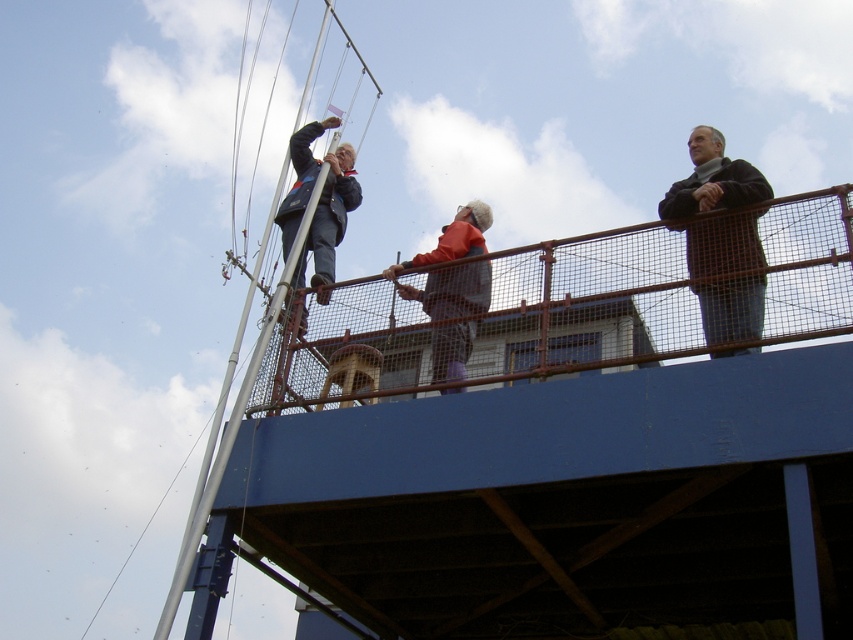
Question: Which point is farther from the camera taking this photo?

Choices:
 (A) (299, 195)
 (B) (462, 371)
 (C) (744, 294)
 (D) (256, 342)

Answer: (A)

Question: Which object is farther from the camera taking this photo?

Choices:
 (A) dark brown leather jacket at upper right
 (B) orange fabric jacket at center
 (C) metallic silver mast at upper left
 (D) dark blue jacket at upper left

Answer: (D)

Question: Is dark brown leather jacket at upper right positioned behind metallic silver mast at upper left?

Choices:
 (A) yes
 (B) no

Answer: (B)

Question: Which object appears farthest from the camera in this image?

Choices:
 (A) dark brown leather jacket at upper right
 (B) metallic silver mast at upper left
 (C) dark blue jacket at upper left

Answer: (C)

Question: Is dark brown leather jacket at upper right further to camera compared to orange fabric jacket at center?

Choices:
 (A) no
 (B) yes

Answer: (A)

Question: Is dark brown leather jacket at upper right further to camera compared to metallic silver mast at upper left?

Choices:
 (A) no
 (B) yes

Answer: (A)